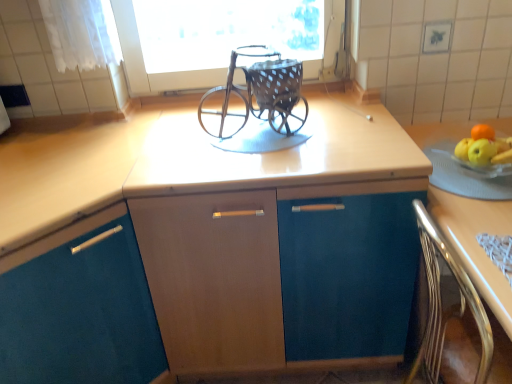
You are a GUI agent. You are given a task and a screenshot of the screen. Output one action in this format:
    pyautogui.click(x=<x>, y=<y>)
    Task: Click on the empty space that is ontop of matte wood cabinet at center, acting as the first cabinetry starting from the right (from a real-world perspective)
    The height and width of the screenshot is (384, 512).
    Given the screenshot: What is the action you would take?
    pyautogui.click(x=261, y=144)